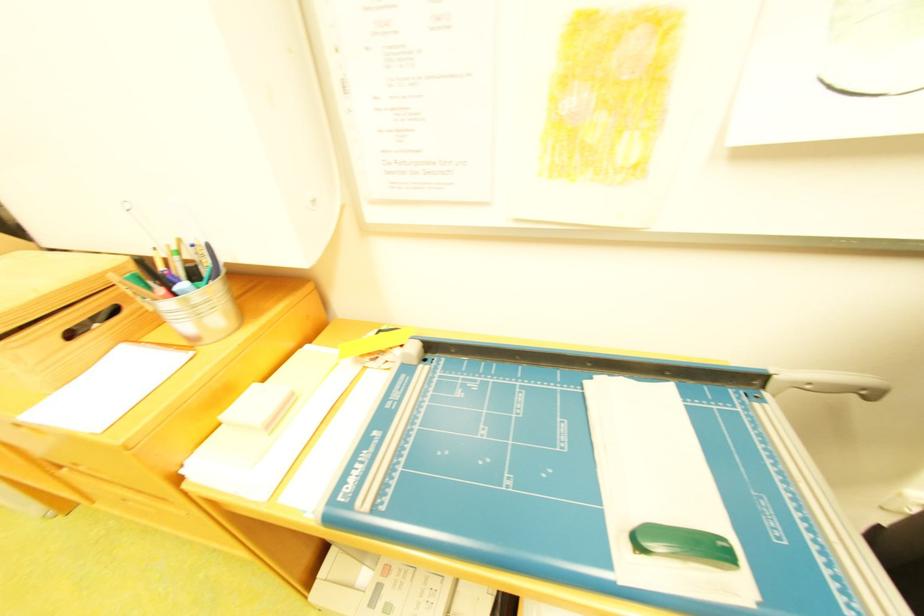
This screenshot has height=616, width=924. What do you see at coordinates (661, 493) in the screenshot? I see `a small white notepad` at bounding box center [661, 493].